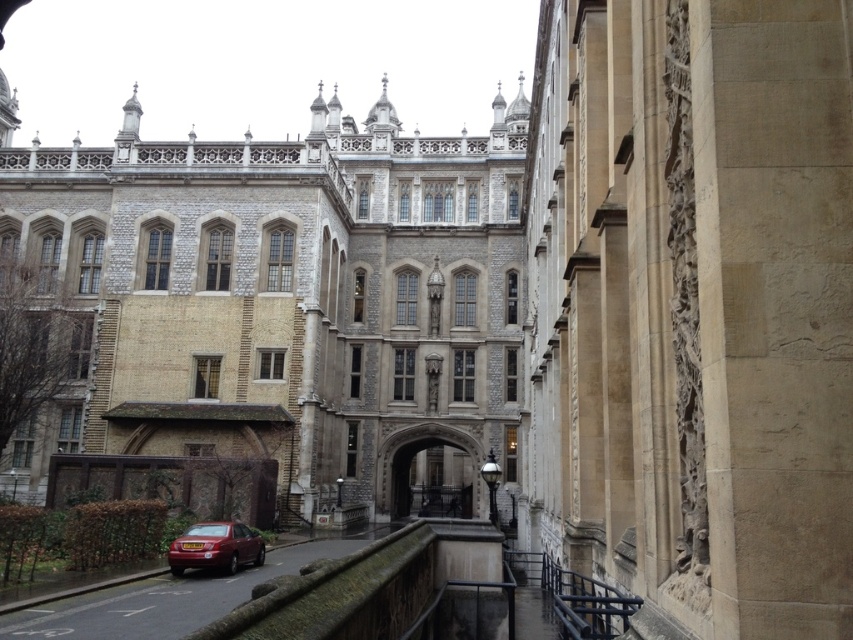
Does metallic car at lower left have a lesser height compared to shiny red sedan at lower center?

Correct, metallic car at lower left is not as tall as shiny red sedan at lower center.

Is metallic car at lower left to the right of shiny red sedan at lower center from the viewer's perspective?

Indeed, metallic car at lower left is positioned on the right side of shiny red sedan at lower center.

Between point (128, 616) and point (216, 566), which one is positioned behind?

The point (216, 566) is behind.

In order to click on metallic car at lower left in this screenshot , I will do `click(167, 598)`.

The height and width of the screenshot is (640, 853). Describe the element at coordinates (215, 547) in the screenshot. I see `shiny red sedan at lower center` at that location.

In order to click on shiny red sedan at lower center in this screenshot , I will do `click(215, 547)`.

Between point (106, 618) and point (405, 474), which one is positioned behind?

The point (405, 474) is behind.

Does metallic car at lower left have a greater width compared to stone archway at center?

Correct, the width of metallic car at lower left exceeds that of stone archway at center.

Locate an element on the screen. Image resolution: width=853 pixels, height=640 pixels. metallic car at lower left is located at coordinates (167, 598).